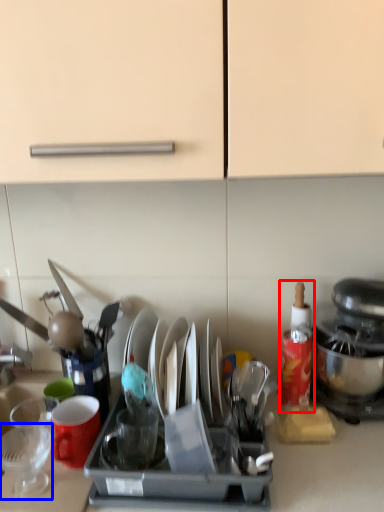
Question: Which of the following is the closest to the observer, bottle (highlighted by a red box) or tableware (highlighted by a blue box)?

Choices:
 (A) bottle
 (B) tableware

Answer: (B)